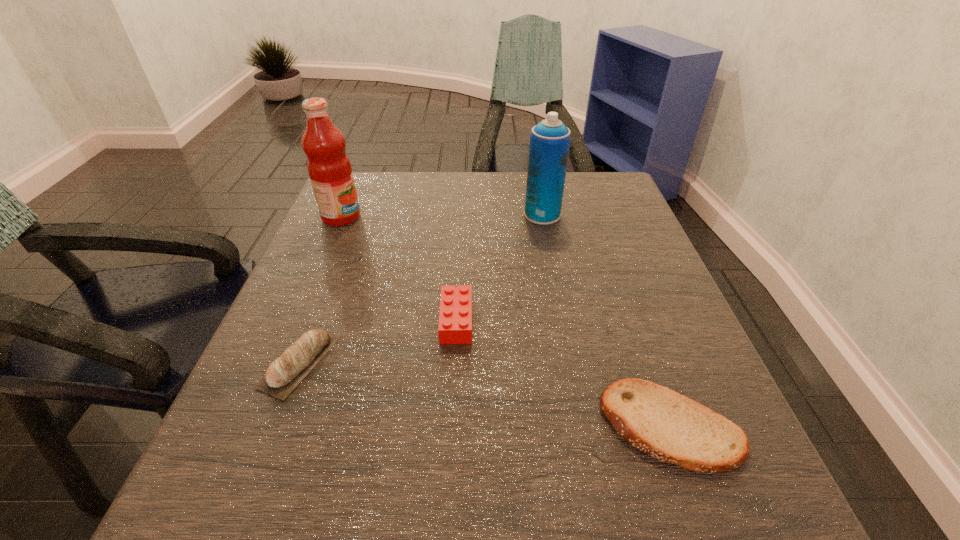
This screenshot has height=540, width=960. In the image, there is a desktop. What are the coordinates of `vacant space at the left edge` in the screenshot? It's located at (324, 431).

Identify the location of free space at the right edge of the desktop. (601, 259).

I want to click on vacant space at the far left corner, so click(396, 183).

The width and height of the screenshot is (960, 540). Identify the location of free space at the far right corner of the desktop. (597, 173).

The width and height of the screenshot is (960, 540). In order to click on blank space at the near right corner of the desktop in this screenshot , I will do `click(760, 510)`.

Image resolution: width=960 pixels, height=540 pixels. In order to click on vacant space that is in between the third object from left to right and the fruit juice in this screenshot , I will do `click(398, 269)`.

In order to click on vacant space that is in between the fruit juice and the right pita bread in this screenshot , I will do `click(506, 321)`.

Where is `free spot between the right pita bread and the aerosol can`? The height and width of the screenshot is (540, 960). free spot between the right pita bread and the aerosol can is located at coordinates (607, 320).

Identify the location of free spot between the right pita bread and the left pita bread. (486, 394).

This screenshot has width=960, height=540. Identify the location of empty space that is in between the aerosol can and the fruit juice. (442, 216).